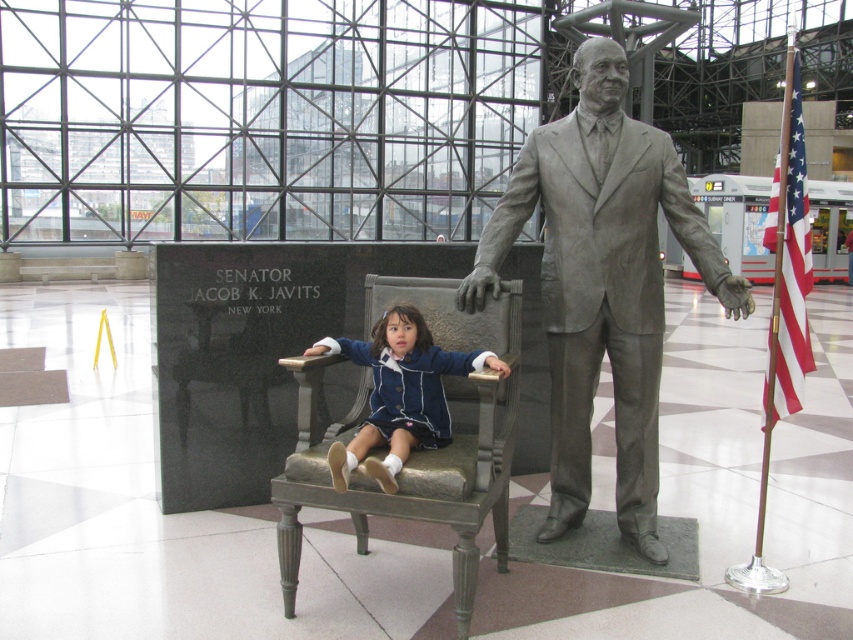
You are an interior designer assessing the space for accessibility. You notice the gray polished statue at center and the blue fabric dress at center. Which object should you be more cautious about for someone with mobility impairments, and why?

The gray polished statue at center is larger in size than the blue fabric dress at center, so it poses a greater obstruction risk for someone with mobility impairments. The statue requires more space to navigate around compared to the smaller dress.